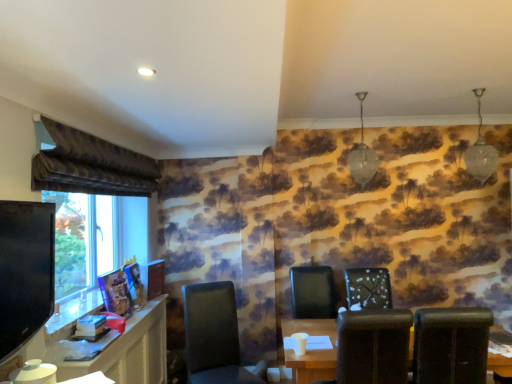
Question: In which direction should I rotate to look at matte black chair at center, which is the 1th chair from left to right?

Choices:
 (A) right
 (B) left

Answer: (B)

Question: Is matte black chair at center, which is the 1th chair from left to right, further to the viewer compared to white textured chair at center, the second chair viewed from the right?

Choices:
 (A) no
 (B) yes

Answer: (A)

Question: Considering the relative sizes of matte black chair at center, which ranks as the fourth chair in right-to-left order, and white textured chair at center, which is counted as the third chair, starting from the left, in the image provided, is matte black chair at center, which ranks as the fourth chair in right-to-left order, wider than white textured chair at center, which is counted as the third chair, starting from the left,?

Choices:
 (A) no
 (B) yes

Answer: (B)

Question: Is matte black chair at center, which ranks as the fourth chair in right-to-left order, positioned far away from white textured chair at center, the second chair viewed from the right?

Choices:
 (A) yes
 (B) no

Answer: (A)

Question: From the image's perspective, is matte black chair at center, which is the 1th chair from left to right, above white textured chair at center, which is counted as the third chair, starting from the left?

Choices:
 (A) no
 (B) yes

Answer: (A)

Question: Does matte black chair at center, which ranks as the fourth chair in right-to-left order, have a larger size compared to white textured chair at center, which is counted as the third chair, starting from the left?

Choices:
 (A) no
 (B) yes

Answer: (B)

Question: Are matte black chair at center, which ranks as the fourth chair in right-to-left order, and white textured chair at center, the second chair viewed from the right, beside each other?

Choices:
 (A) no
 (B) yes

Answer: (A)

Question: Is velvet brown curtain at upper left positioned with its back to brown leather chair at center, the second chair when ordered from left to right?

Choices:
 (A) no
 (B) yes

Answer: (A)

Question: Is velvet brown curtain at upper left aimed at brown leather chair at center, the second chair when ordered from left to right?

Choices:
 (A) yes
 (B) no

Answer: (B)

Question: Does velvet brown curtain at upper left have a smaller size compared to brown leather chair at center, which is counted as the 3th chair, starting from the right?

Choices:
 (A) no
 (B) yes

Answer: (B)

Question: Is velvet brown curtain at upper left in front of brown leather chair at center, which is counted as the 3th chair, starting from the right?

Choices:
 (A) no
 (B) yes

Answer: (B)

Question: Does velvet brown curtain at upper left have a larger size compared to brown leather chair at center, the second chair when ordered from left to right?

Choices:
 (A) no
 (B) yes

Answer: (A)

Question: From the image's perspective, does velvet brown curtain at upper left appear higher than brown leather chair at center, the second chair when ordered from left to right?

Choices:
 (A) no
 (B) yes

Answer: (B)

Question: Is matte brown table at lower center further to camera compared to matte black computer desk at lower left?

Choices:
 (A) yes
 (B) no

Answer: (A)